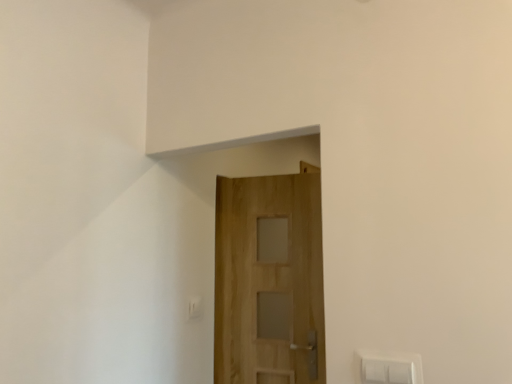
Describe the element at coordinates (195, 307) in the screenshot. This screenshot has height=384, width=512. I see `white plastic light switch at lower center` at that location.

The height and width of the screenshot is (384, 512). Find the location of `white plastic light switch at lower center`. white plastic light switch at lower center is located at coordinates [195, 307].

What is the approximate height of white plastic light switch at lower center?

white plastic light switch at lower center is 5.22 inches tall.

This screenshot has width=512, height=384. Describe the element at coordinates (269, 280) in the screenshot. I see `natural wood door at center` at that location.

In order to face natural wood door at center, should I rotate leftwards or rightwards?

Turn right approximately 2.273 degrees to face it.

Locate an element on the screen. The image size is (512, 384). natural wood door at center is located at coordinates (269, 280).

Identify the location of white plastic light switch at lower center. (195, 307).

Is natural wood door at center at the right side of white plastic light switch at lower center?

Correct, you'll find natural wood door at center to the right of white plastic light switch at lower center.

Between natural wood door at center and white plastic light switch at lower center, which one is positioned behind?

white plastic light switch at lower center.

Between point (241, 253) and point (197, 297), which one is positioned in front?

The point (197, 297) is in front.

From the image's perspective, which one is positioned lower, natural wood door at center or white plastic light switch at lower center?

white plastic light switch at lower center.

From a real-world perspective, is natural wood door at center below white plastic light switch at lower center?

No, from a real-world perspective, natural wood door at center is not below white plastic light switch at lower center.

Consider the image. Does natural wood door at center have a greater width compared to white plastic light switch at lower center?

Indeed, natural wood door at center has a greater width compared to white plastic light switch at lower center.

Considering the sizes of natural wood door at center and white plastic light switch at lower center in the image, is natural wood door at center taller or shorter than white plastic light switch at lower center?

Considering their sizes, natural wood door at center has more height than white plastic light switch at lower center.

Which of these two, natural wood door at center or white plastic light switch at lower center, is bigger?

natural wood door at center.

Is natural wood door at center not inside white plastic light switch at lower center?

natural wood door at center is positioned outside white plastic light switch at lower center.

Is natural wood door at center far from white plastic light switch at lower center?

They are positioned close to each other.

Is natural wood door at center looking in the opposite direction of white plastic light switch at lower center?

natural wood door at center is not turned away from white plastic light switch at lower center.

How different are the orientations of natural wood door at center and white plastic light switch at lower center in degrees?

There is a 80.7-degree angle between the facing directions of natural wood door at center and white plastic light switch at lower center.

You are a GUI agent. You are given a task and a screenshot of the screen. Output one action in this format:
    pyautogui.click(x=<x>, y=<y>)
    Task: Click on the light switch on the left of natural wood door at center
    This screenshot has width=512, height=384.
    Given the screenshot: What is the action you would take?
    pyautogui.click(x=195, y=307)

Is white plastic light switch at lower center to the left of natural wood door at center from the viewer's perspective?

Indeed, white plastic light switch at lower center is positioned on the left side of natural wood door at center.

Is the depth of white plastic light switch at lower center greater than that of natural wood door at center?

Yes.

Which is behind, point (199, 310) or point (222, 242)?

The point (222, 242) is behind.

From the image's perspective, which is below, white plastic light switch at lower center or natural wood door at center?

white plastic light switch at lower center appears lower in the image.

From a real-world perspective, is white plastic light switch at lower center physically located above or below natural wood door at center?

In terms of real-world spatial position, white plastic light switch at lower center is below natural wood door at center.

From the picture: Between white plastic light switch at lower center and natural wood door at center, which one has smaller width?

white plastic light switch at lower center.

Does white plastic light switch at lower center have a lesser height compared to natural wood door at center?

Yes.

Considering the sizes of objects white plastic light switch at lower center and natural wood door at center in the image provided, who is bigger, white plastic light switch at lower center or natural wood door at center?

natural wood door at center.

Would you say white plastic light switch at lower center contains natural wood door at center?

No.

Is white plastic light switch at lower center not close to natural wood door at center?

No, there isn't a large distance between white plastic light switch at lower center and natural wood door at center.

Could you tell me if white plastic light switch at lower center is facing natural wood door at center?

No, white plastic light switch at lower center is not oriented towards natural wood door at center.

How different are the orientations of white plastic light switch at lower center and natural wood door at center in degrees?

The angular difference between white plastic light switch at lower center and natural wood door at center is 80.7 degrees.

How far apart are white plastic light switch at lower center and natural wood door at center?

They are 18.91 inches apart.

I want to click on light switch lying below the natural wood door at center (from the image's perspective), so click(x=195, y=307).

In the image, there is a natural wood door at center. Where is `light switch below it (from the image's perspective)`? light switch below it (from the image's perspective) is located at coordinates (195, 307).

Where is `door above the white plastic light switch at lower center (from the image's perspective)`? door above the white plastic light switch at lower center (from the image's perspective) is located at coordinates (269, 280).